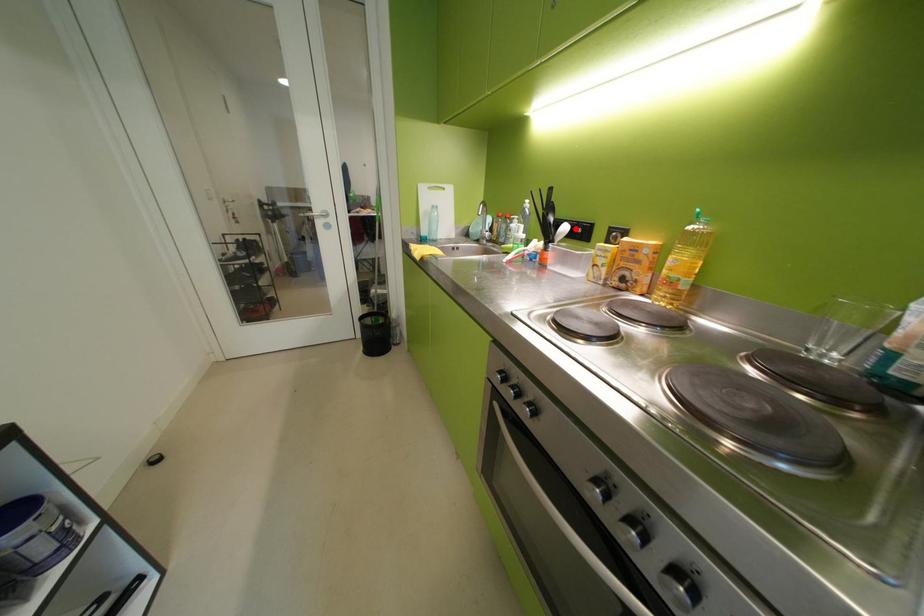
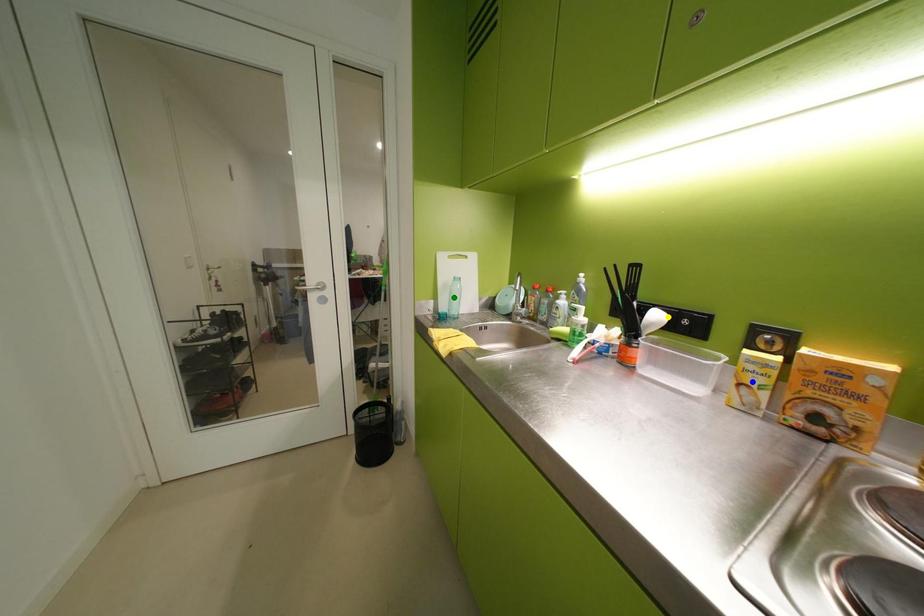
Question: I am providing you with two images of the same scene from different viewpoints. A red point is marked on the first image. You are given multiple points on the second image. In image 2, which mark is for the same physical point as the one in image 1?

Choices:
 (A) yellow point
 (B) green point
 (C) blue point

Answer: (A)